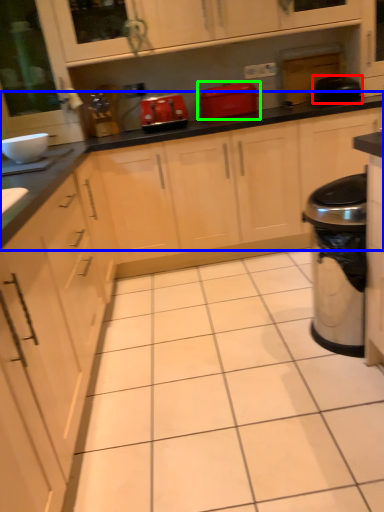
Question: Which is farther away from appliance (highlighted by a red box)? countertop (highlighted by a blue box) or home appliance (highlighted by a green box)?

Choices:
 (A) countertop
 (B) home appliance

Answer: (B)